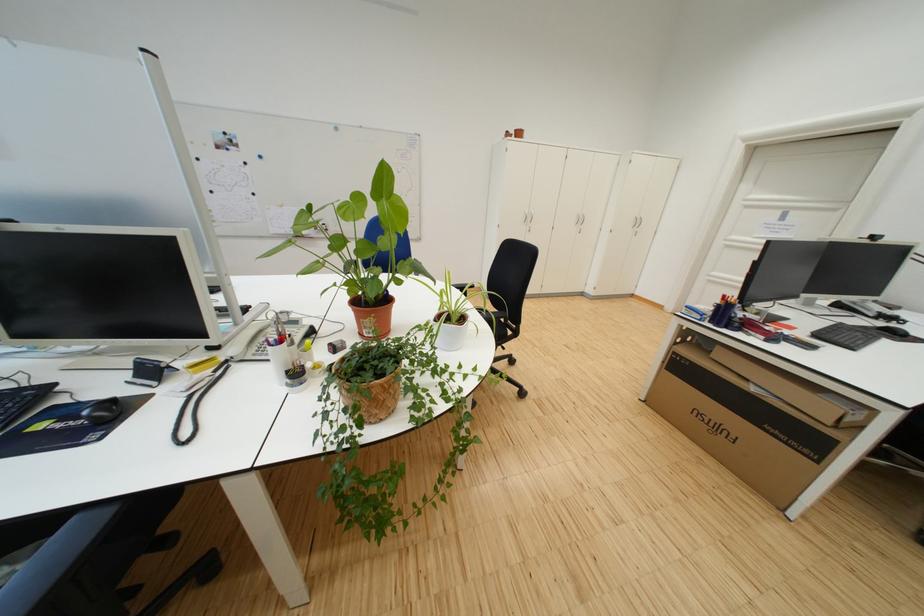
The width and height of the screenshot is (924, 616). What are the coordinates of `red stapler` in the screenshot? It's located at (759, 330).